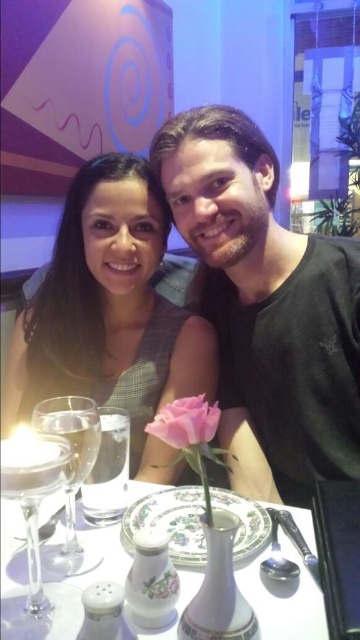
Question: Can you confirm if matte black dress at center is bigger than porcelain vase at center?

Choices:
 (A) no
 (B) yes

Answer: (B)

Question: Does clear glass wine glass at left appear under clear glass wine glass at lower left?

Choices:
 (A) no
 (B) yes

Answer: (B)

Question: Does porcelain vase at center have a larger size compared to pink matte rose at center?

Choices:
 (A) yes
 (B) no

Answer: (A)

Question: Which point is farther to the camera?

Choices:
 (A) (96, 417)
 (B) (163, 413)

Answer: (A)

Question: Which of the following is the farthest from the observer?

Choices:
 (A) (97, 538)
 (B) (75, 413)

Answer: (A)

Question: Which point is farther to the camera?

Choices:
 (A) clear glass wine glass at left
 (B) porcelain vase at center
 (C) clear glass wine glass at lower left
 (D) matte black dress at center

Answer: (D)